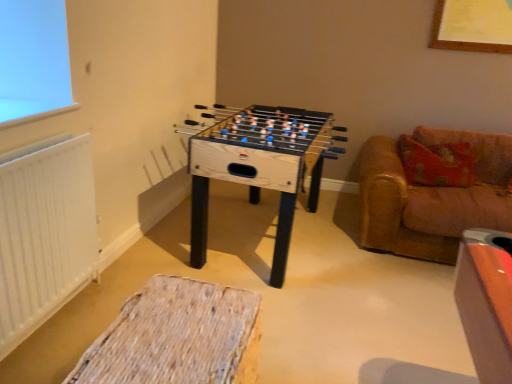
Question: Is woven fabric ottoman at lower center looking in the opposite direction of leather couch at right?

Choices:
 (A) no
 (B) yes

Answer: (A)

Question: Considering the relative sizes of woven fabric ottoman at lower center and leather couch at right in the image provided, is woven fabric ottoman at lower center smaller than leather couch at right?

Choices:
 (A) no
 (B) yes

Answer: (B)

Question: Can you confirm if woven fabric ottoman at lower center is taller than leather couch at right?

Choices:
 (A) no
 (B) yes

Answer: (A)

Question: Can you confirm if woven fabric ottoman at lower center is bigger than leather couch at right?

Choices:
 (A) yes
 (B) no

Answer: (B)

Question: Considering the relative positions of woven fabric ottoman at lower center and leather couch at right in the image provided, is woven fabric ottoman at lower center to the left of leather couch at right from the viewer's perspective?

Choices:
 (A) no
 (B) yes

Answer: (B)

Question: From a real-world perspective, is woven fabric ottoman at lower center physically above leather couch at right?

Choices:
 (A) yes
 (B) no

Answer: (B)

Question: Is white matte radiator at left oriented towards woven fabric ottoman at lower center?

Choices:
 (A) no
 (B) yes

Answer: (B)

Question: Is the depth of white matte radiator at left greater than that of woven fabric ottoman at lower center?

Choices:
 (A) no
 (B) yes

Answer: (B)

Question: From a real-world perspective, is white matte radiator at left located higher than woven fabric ottoman at lower center?

Choices:
 (A) no
 (B) yes

Answer: (B)

Question: From the image's perspective, would you say white matte radiator at left is shown under woven fabric ottoman at lower center?

Choices:
 (A) yes
 (B) no

Answer: (B)

Question: Is white matte radiator at left far from woven fabric ottoman at lower center?

Choices:
 (A) yes
 (B) no

Answer: (B)

Question: Is white matte radiator at left wider than woven fabric ottoman at lower center?

Choices:
 (A) no
 (B) yes

Answer: (A)

Question: From a real-world perspective, is natural wood foosball table at center on top of white matte radiator at left?

Choices:
 (A) no
 (B) yes

Answer: (A)